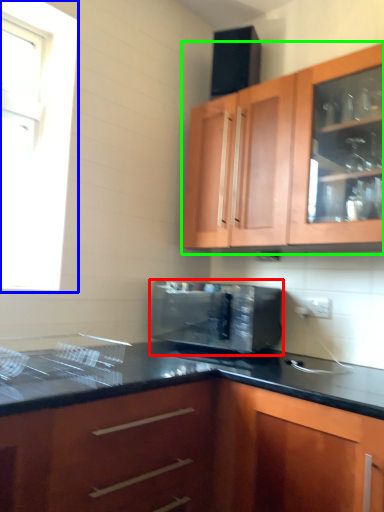
Question: Based on their relative distances, which object is nearer to microwave oven (highlighted by a red box)? Choose from window (highlighted by a blue box) and cabinetry (highlighted by a green box).

Choices:
 (A) window
 (B) cabinetry

Answer: (B)